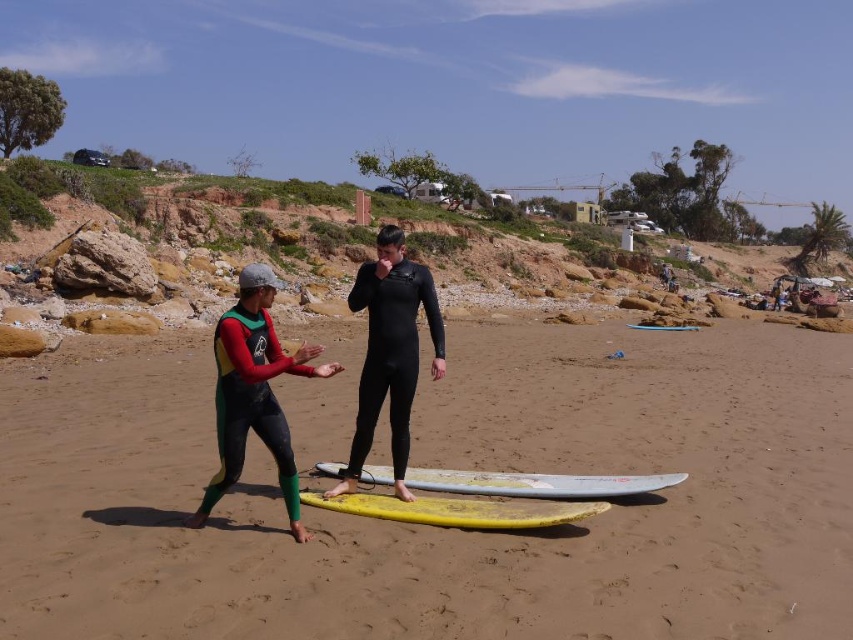
Question: Is neon green neoprene wetsuit at center below yellow matte surfboard at center?

Choices:
 (A) no
 (B) yes

Answer: (A)

Question: Based on their relative distances, which object is nearer to the smooth sand at center?

Choices:
 (A) neon green neoprene wetsuit at center
 (B) light blue smooth surfboard at center
 (C) multicolored neoprene wetsuit at center

Answer: (A)

Question: Does smooth sand at center lie behind yellow matte surfboard at center?

Choices:
 (A) yes
 (B) no

Answer: (B)

Question: Which point is farther to the camera?

Choices:
 (A) (808, 438)
 (B) (264, 348)

Answer: (A)

Question: Does smooth sand at center have a lesser width compared to black matte wetsuit at center?

Choices:
 (A) no
 (B) yes

Answer: (A)

Question: Among these objects, which one is nearest to the camera?

Choices:
 (A) neon green neoprene wetsuit at center
 (B) yellow matte surfboard at center

Answer: (A)